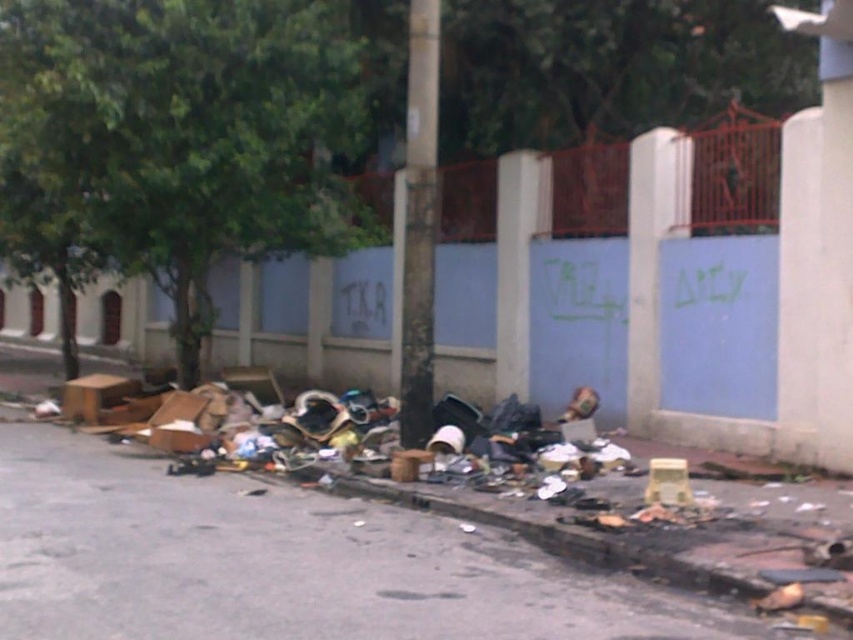
You are a delivery drone flying over an urban street scene with litter. You need to land at a specific location. There are two points marked on your map. The first point is at coordinate point(x=15, y=228) and the second is at point(x=381, y=563). Which point is closer to the tree on the left side of the scene?

Point(x=381, y=563) is closer to the tree on the left side of the scene because it is in front of point(x=15, y=228), which is further away from the tree.

You are a city planner analyzing the urban street scene. You see a point labeled at coordinates (177, 140). What does this point represent in the scene?

The point at coordinates (177, 140) indicates the location of the green leafy tree at upper left in the scene.